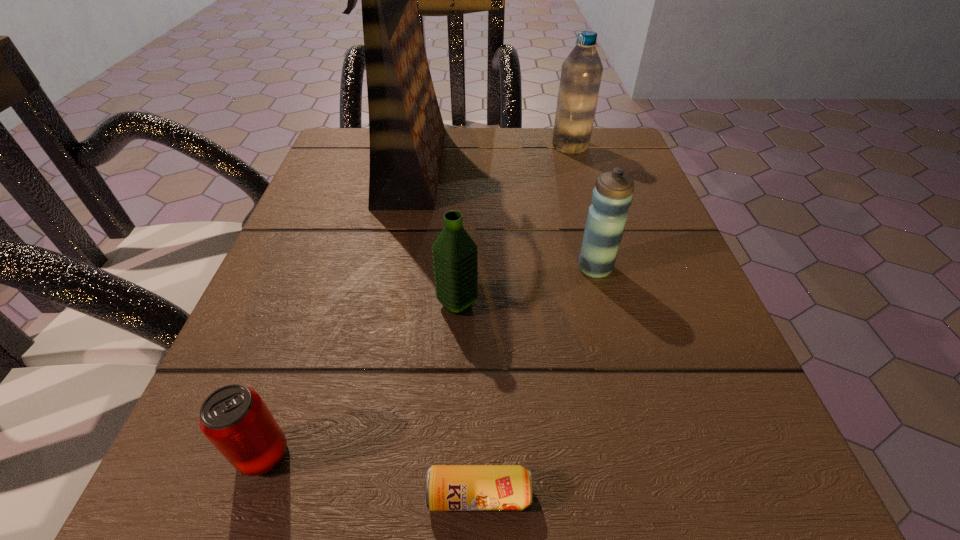
Where is `the tallest object`? The image size is (960, 540). the tallest object is located at coordinates (406, 130).

The width and height of the screenshot is (960, 540). I want to click on the farthest water bottle, so click(581, 72).

Locate an element on the screen. The image size is (960, 540). the fifth shortest object is located at coordinates (581, 72).

This screenshot has height=540, width=960. I want to click on the third farthest object, so click(x=612, y=195).

Where is `the nearest water bottle`? Image resolution: width=960 pixels, height=540 pixels. the nearest water bottle is located at coordinates (454, 252).

Where is `the leftmost water bottle`? Image resolution: width=960 pixels, height=540 pixels. the leftmost water bottle is located at coordinates (454, 252).

The image size is (960, 540). In order to click on the fifth tallest object in this screenshot , I will do `click(235, 419)`.

At what (x,y) coordinates should I click in order to perform the action: click on the shortest object. Please return your answer as a coordinate pair (x, y). The image size is (960, 540). Looking at the image, I should click on (447, 487).

In order to click on vacant area located 0.250m on the front-facing side of the shopping bag in this screenshot , I will do `click(576, 164)`.

Find the location of a particular element. vacant point located on the front of the second tallest object is located at coordinates (597, 239).